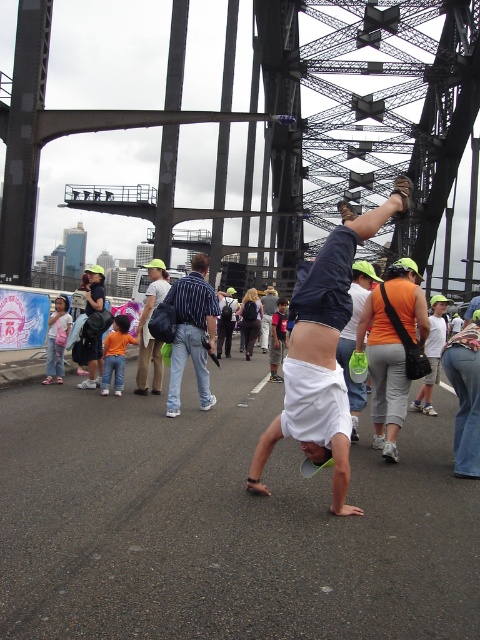
You are a photographer standing at the Sydney Harbour Bridge. You want to take a photo of the striped shirt at center without including the black steel bridge at center in the frame. Is the distance between them sufficient to achieve this using a standard zoom lens with a maximum zoom range of 100 meters?

The distance between the black steel bridge at center and striped shirt at center is 55.25 meters. Since the maximum zoom range is 100 meters, the photographer can zoom in sufficiently to capture the striped shirt at center while excluding the black steel bridge at center from the frame.

You are a photographer planning to take a photo of the black steel bridge at center and the striped shirt at center. Based on their sizes in the image, which object would appear taller in the photo?

The black steel bridge at center appears taller in the photo because it has a greater height compared to the striped shirt at center.